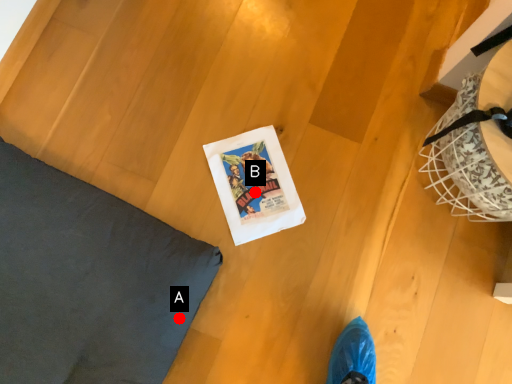
Question: Two points are circled on the image, labeled by A and B beside each circle. Which point is farther to the camera?

Choices:
 (A) A is further
 (B) B is further

Answer: (B)